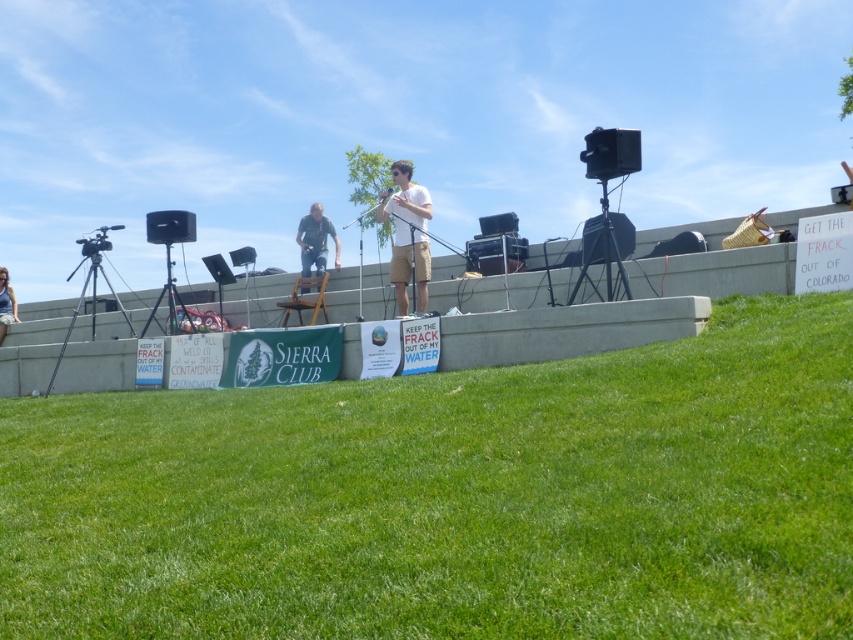
You need to place a 1.2 meter wide box between the white cotton shirt at center and the black matte tripod at right. Is there enough space?

The white cotton shirt at center might be wider than black matte tripod at right, so the space between them may not be sufficient for a 1.2 meter wide box. Check the actual distance before placing the box.

In the scene shown: You are a photographer at the event and want to capture a photo of the white cotton shirt at center and the black matte tripod at right. Which object will appear larger in the photo?

The white cotton shirt at center will appear larger in the photo because it is closer to the viewer than the black matte tripod at right.